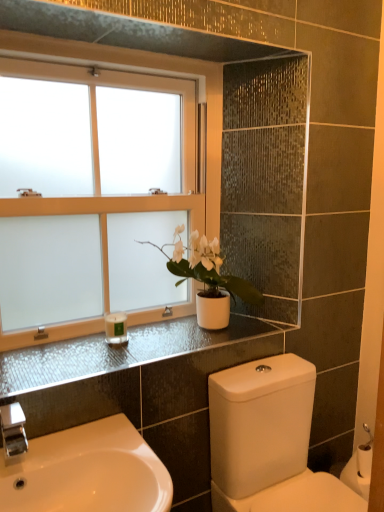
At what (x,y) coordinates should I click in order to perform the action: click on blank space above white frosted glass window at upper left (from a real-world perspective). Please return your answer as a coordinate pair (x, y). This screenshot has width=384, height=512. Looking at the image, I should click on (115, 49).